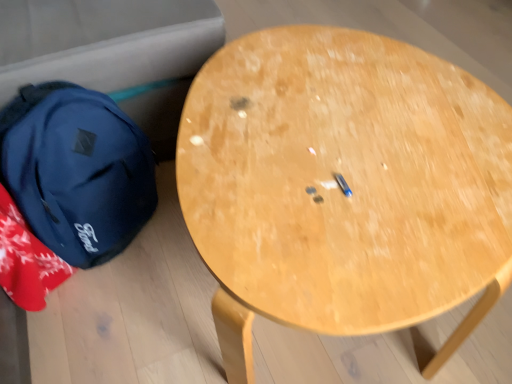
Question: From a real-world perspective, is matte blue backpack at left above or below light wood table at center?

Choices:
 (A) below
 (B) above

Answer: (A)

Question: Relative to light wood table at center, is matte blue backpack at left in front or behind?

Choices:
 (A) behind
 (B) front

Answer: (A)

Question: Does point (68, 89) appear closer or farther from the camera than point (423, 296)?

Choices:
 (A) closer
 (B) farther

Answer: (B)

Question: Is light wood table at center bigger or smaller than matte blue backpack at left?

Choices:
 (A) big
 (B) small

Answer: (A)

Question: Relative to matte blue backpack at left, is light wood table at center in front or behind?

Choices:
 (A) behind
 (B) front

Answer: (B)

Question: Choose the correct answer: Is light wood table at center inside matte blue backpack at left or outside it?

Choices:
 (A) inside
 (B) outside

Answer: (B)

Question: Is point (283, 64) positioned closer to the camera than point (117, 132)?

Choices:
 (A) farther
 (B) closer

Answer: (B)